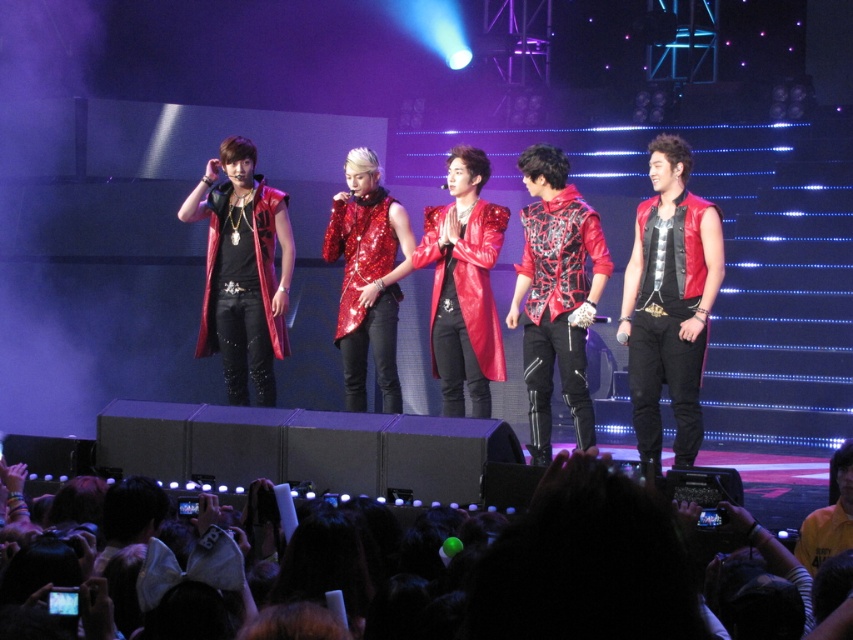
Question: Does shiny red vest at right have a greater width compared to black fabric crowd at lower center?

Choices:
 (A) no
 (B) yes

Answer: (B)

Question: Does shiny red vest at right lie behind black fabric crowd at lower center?

Choices:
 (A) yes
 (B) no

Answer: (A)

Question: Is the position of shiny red vest at right more distant than that of black fabric crowd at lower center?

Choices:
 (A) no
 (B) yes

Answer: (B)

Question: Which point is farther from the camera taking this photo?

Choices:
 (A) (757, 538)
 (B) (718, 269)

Answer: (B)

Question: Among these points, which one is nearest to the camera?

Choices:
 (A) (666, 376)
 (B) (247, 600)

Answer: (B)